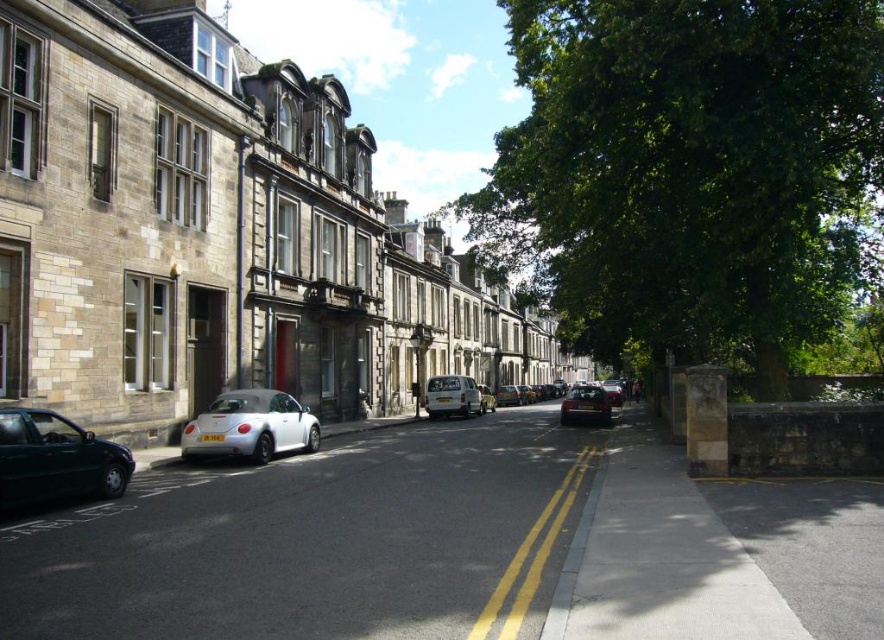
Does white matte convertible at center appear on the right side of white matte car at center?

In fact, white matte convertible at center is to the left of white matte car at center.

Between point (296, 429) and point (488, 390), which one is positioned behind?

The point (488, 390) is more distant.

Describe the element at coordinates (250, 426) in the screenshot. The width and height of the screenshot is (884, 640). I see `white matte convertible at center` at that location.

You are a GUI agent. You are given a task and a screenshot of the screen. Output one action in this format:
    pyautogui.click(x=<x>, y=<y>)
    Task: Click on the white matte convertible at center
    
    Given the screenshot: What is the action you would take?
    pyautogui.click(x=250, y=426)

Is shiny dark green car at lower left taller than shiny black car at center?

Incorrect, shiny dark green car at lower left's height is not larger of shiny black car at center's.

What are the coordinates of `shiny dark green car at lower left` in the screenshot? It's located at (55, 460).

This screenshot has width=884, height=640. What are the coordinates of `shiny dark green car at lower left` in the screenshot? It's located at (55, 460).

Does point (583, 388) come farther from viewer compared to point (501, 396)?

No, (583, 388) is closer to viewer.

Image resolution: width=884 pixels, height=640 pixels. What do you see at coordinates (585, 404) in the screenshot?
I see `shiny black car at center` at bounding box center [585, 404].

Between point (565, 420) and point (504, 396), which one is positioned in front?

Positioned in front is point (565, 420).

Image resolution: width=884 pixels, height=640 pixels. I want to click on shiny black car at center, so click(585, 404).